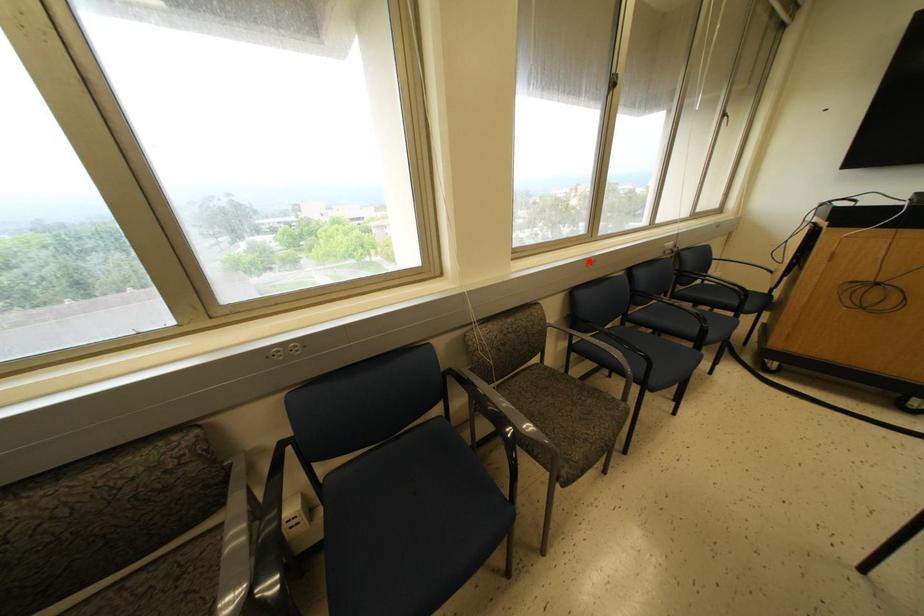
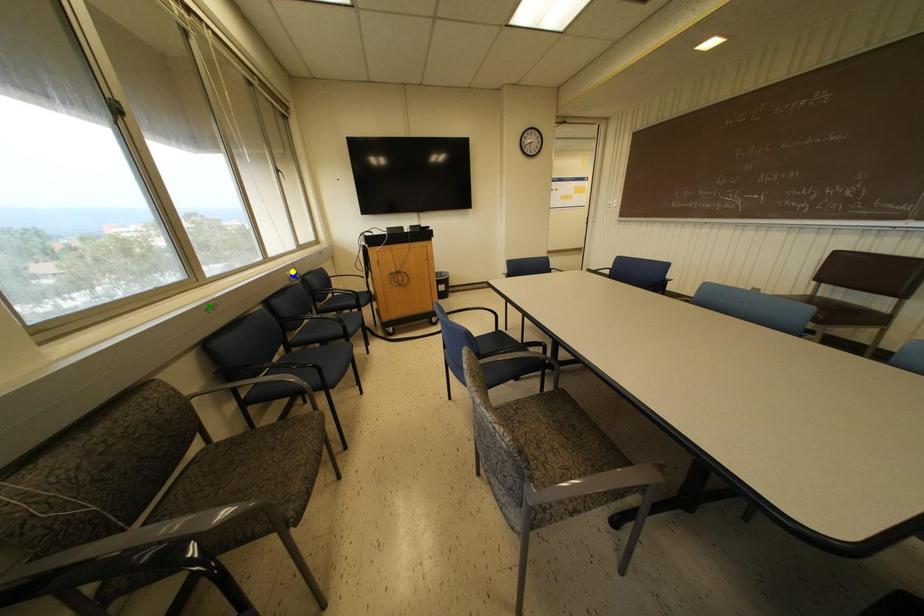
Question: I am providing you with two images of the same scene from different viewpoints. A red point is marked on the first image. You are given multiple points on the second image. Which mark in image 2 goes with the point in image 1?

Choices:
 (A) blue point
 (B) yellow point
 (C) green point

Answer: (C)